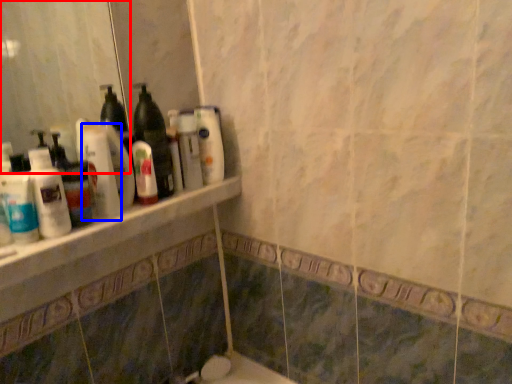
Question: Which point is closer to the camera, mirror (highlighted by a red box) or cleaning product (highlighted by a blue box)?

Choices:
 (A) mirror
 (B) cleaning product

Answer: (A)